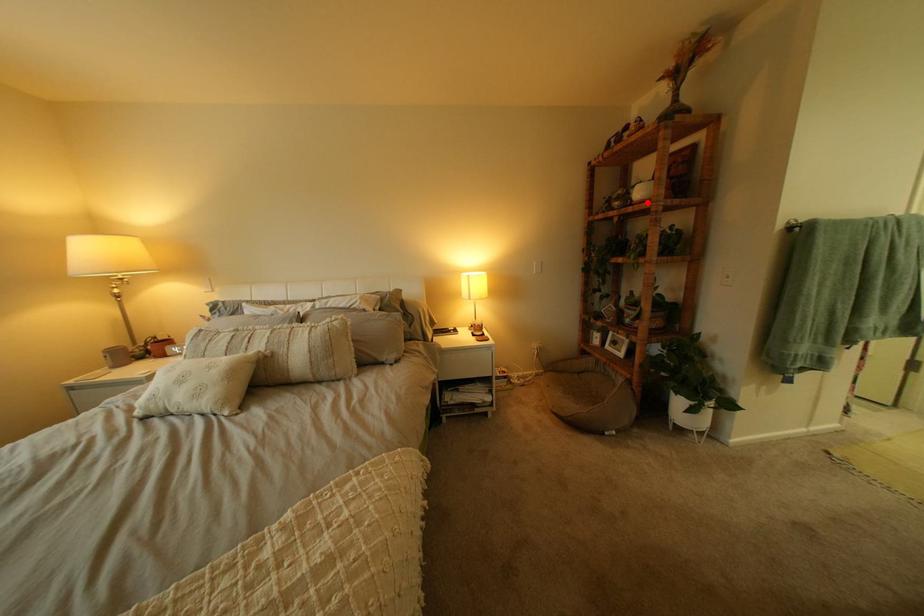
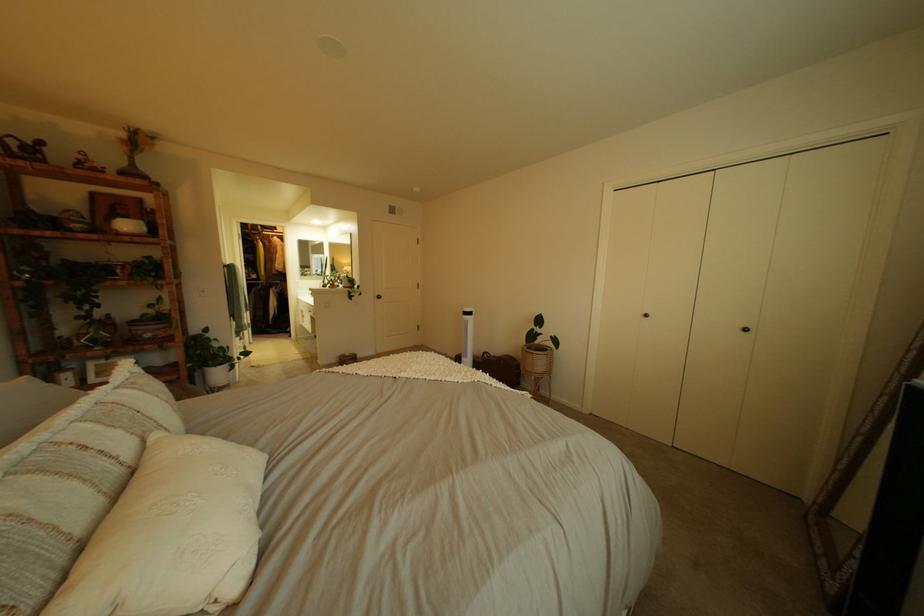
Locate, in the second image, the point that corresponds to the highlighted location in the first image.

(132, 232)